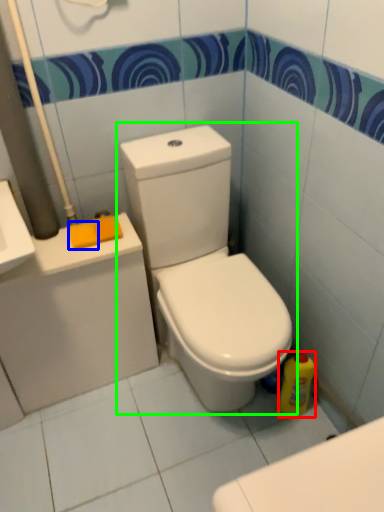
Question: Which object is the closest to the cleaning product (highlighted by a red box)? Choose among these: soap (highlighted by a blue box) or toilet (highlighted by a green box).

Choices:
 (A) soap
 (B) toilet

Answer: (B)